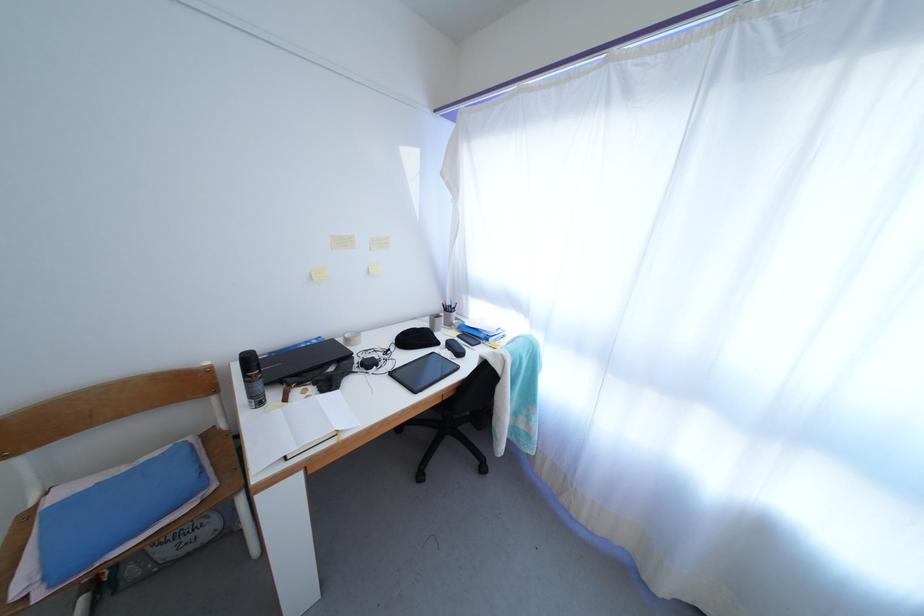
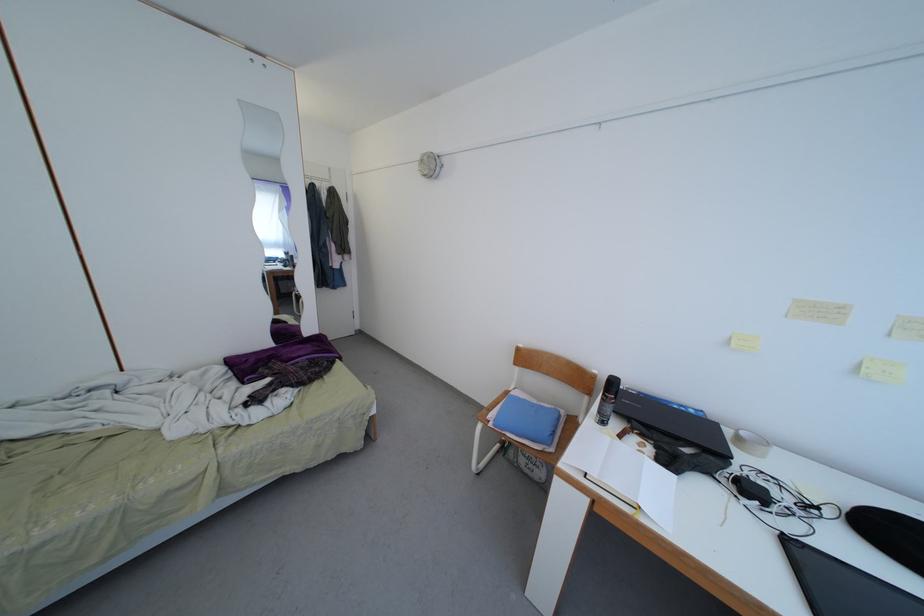
Question: The images are taken continuously from a first-person perspective. In which direction is your viewpoint rotating?

Choices:
 (A) Left
 (B) Right
 (C) Up
 (D) Down

Answer: (A)